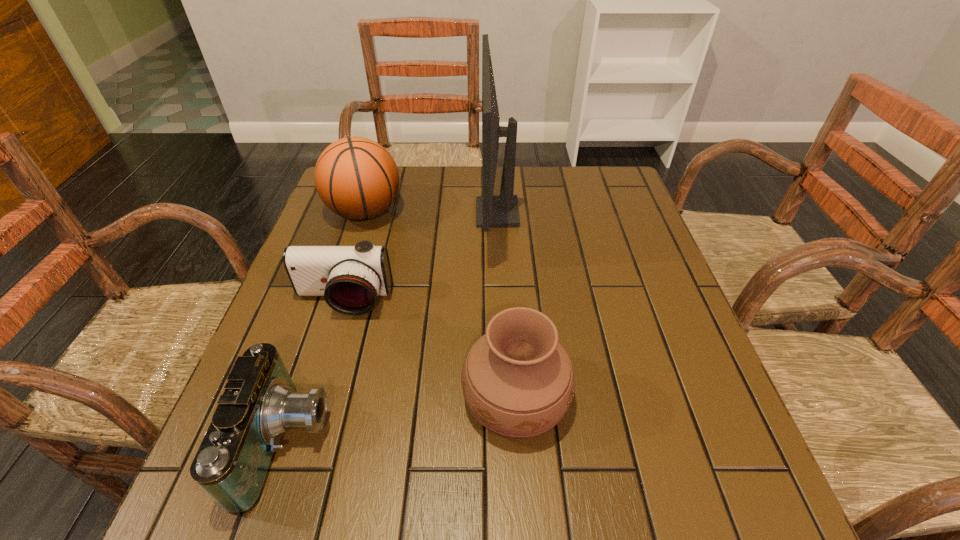
I want to click on vacant space at the left edge, so click(286, 442).

Where is `vacant space at the right edge of the desktop`? The height and width of the screenshot is (540, 960). vacant space at the right edge of the desktop is located at coordinates (641, 313).

Identify the location of vacant area at the far right corner of the desktop. The image size is (960, 540). 603,207.

In order to click on free spot between the urn and the computer monitor in this screenshot , I will do `click(507, 305)`.

Where is `free space between the tallest object and the farther camcorder`? The height and width of the screenshot is (540, 960). free space between the tallest object and the farther camcorder is located at coordinates (420, 257).

Locate an element on the screen. This screenshot has height=540, width=960. vacant region between the nearer camcorder and the basketball is located at coordinates click(326, 327).

You are a GUI agent. You are given a task and a screenshot of the screen. Output one action in this format:
    pyautogui.click(x=<x>, y=<y>)
    Task: Click on the free space between the nearer camcorder and the tallest object
    The image size is (960, 540).
    Given the screenshot: What is the action you would take?
    pyautogui.click(x=393, y=327)

I want to click on blank region between the computer monitor and the urn, so coord(507,305).

You are a GUI agent. You are given a task and a screenshot of the screen. Output one action in this format:
    pyautogui.click(x=<x>, y=<y>)
    Task: Click on the unoccupied position between the nearer camcorder and the urn
    The width and height of the screenshot is (960, 540).
    Given the screenshot: What is the action you would take?
    pyautogui.click(x=401, y=419)

Where is `unoccupied position between the nearer camcorder and the third farthest object`? unoccupied position between the nearer camcorder and the third farthest object is located at coordinates click(x=316, y=372).